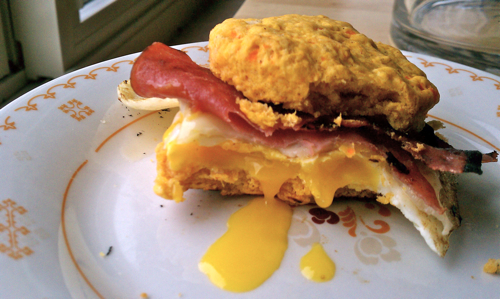
The width and height of the screenshot is (500, 299). In order to click on plate in this screenshot , I will do `click(100, 189)`.